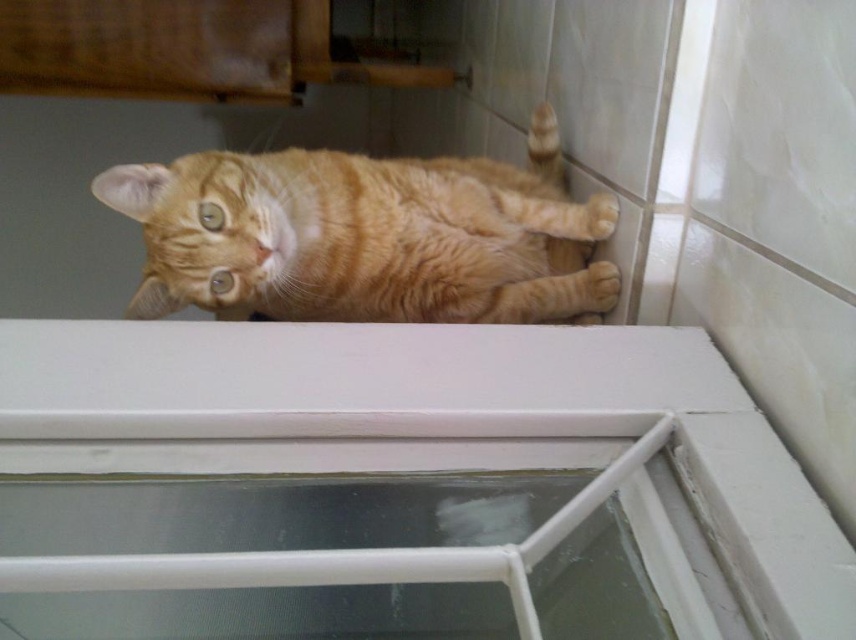
You are a delivery person who needs to place a small package on the floor in the bathroom without disturbing the orange tabby cat at upper center. The package is 30 centimeters wide. Can you safely place it near the transparent plastic window at center?

The orange tabby cat at upper center and transparent plastic window at center are 40.52 centimeters apart. Since the package is 30 centimeters wide, placing it near the window would leave enough space between the cat and the package, so it can be done safely without disturbing the cat.

You are a small toy mouse placed on the bathroom floor. You want to reach the transparent plastic window at center but must avoid the orange tabby cat at upper center. Since the cat is taller than the window, can you crawl under the cat to reach the window?

The orange tabby cat at upper center is taller than the transparent plastic window at center, so the toy mouse cannot crawl under the cat to reach the window because the cat is taller and would block the path.

You are a pet sitter in the bathroom where the orange tabby cat at upper center and the transparent plastic window at center are located. You need to place a small toy between them. Considering their sizes, which object should the toy be closer to to ensure it doesn

The orange tabby cat at upper center is larger than the transparent plastic window at center, so the toy should be placed closer to the transparent plastic window at center to maintain balance between the two objects.